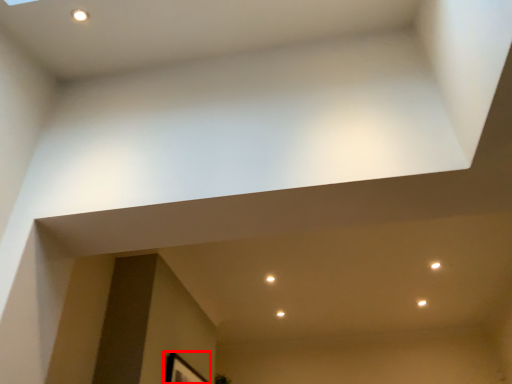
Question: From the image's perspective, considering the relative positions of picture frame (annotated by the red box) and light in the image provided, where is picture frame (annotated by the red box) located with respect to the staircase?

Choices:
 (A) above
 (B) below

Answer: (B)